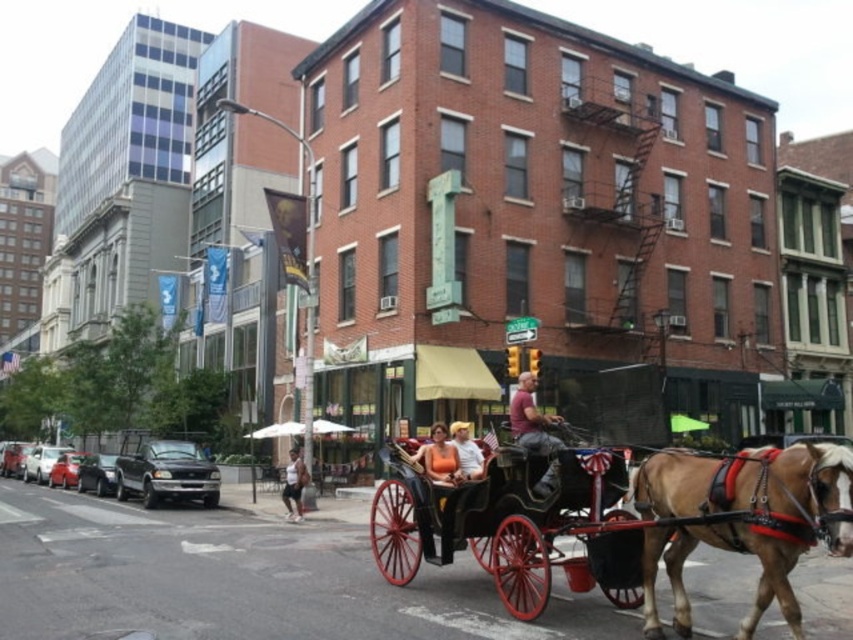
You are standing at the point with coordinates point (801, 468) and want to walk towards the point with coordinates point (523, 435). Based on the scene described, will you be moving towards the historic brick building or away from it?

Point (801, 468) is in front of point (523, 435). Since you are moving from the point in front to the one behind, you will be moving away from the historic brick building on the right side of the street.

You are standing at the point with coordinates point (613, 518). Looking around, you see the wooden polished horse cart at center. What is the nearest object to you?

The nearest object to you is the wooden polished horse cart at center, as you are standing exactly at the point corresponding to it.

You are a delivery person who needs to pass under a low clearance archway that is exactly the height of the wooden polished horse cart at center. Can you safely walk through the archway while wearing the matte red shirt at center on your back?

The wooden polished horse cart at center is taller than the matte red shirt at center, so the archway is at least as tall as the horse cart. Since the shirt is shorter, you can safely walk through the archway while wearing the matte red shirt at center on your back.